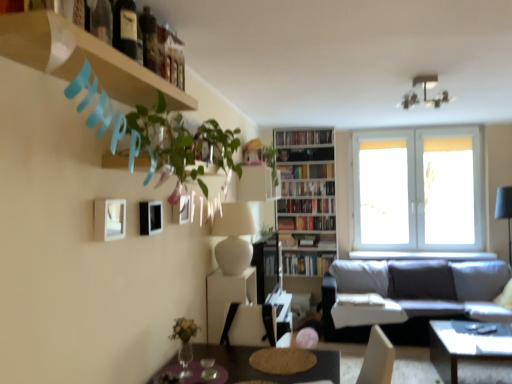
Question: From the image's perspective, is hardcover books at upper center, which is the first book in top-to-bottom order, beneath green leafy plant at upper left, the first plant viewed from the left?

Choices:
 (A) yes
 (B) no

Answer: (B)

Question: Can you confirm if hardcover books at upper center, which is the sixth book in bottom-to-top order, is taller than green leafy plant at upper left, which is the 1th plant in front-to-back order?

Choices:
 (A) no
 (B) yes

Answer: (A)

Question: Considering the relative positions of hardcover books at upper center, which is the first book in top-to-bottom order, and green leafy plant at upper left, which ranks as the 3th plant in back-to-front order, in the image provided, is hardcover books at upper center, which is the first book in top-to-bottom order, behind green leafy plant at upper left, which ranks as the 3th plant in back-to-front order,?

Choices:
 (A) no
 (B) yes

Answer: (B)

Question: Can you confirm if hardcover books at upper center, which is the first book in top-to-bottom order, is smaller than green leafy plant at upper left, which ranks as the 3th plant in back-to-front order?

Choices:
 (A) yes
 (B) no

Answer: (A)

Question: Does hardcover books at upper center, which is the sixth book in bottom-to-top order, have a lesser width compared to green leafy plant at upper left, which ranks as the 3th plant in back-to-front order?

Choices:
 (A) yes
 (B) no

Answer: (A)

Question: Looking at their shapes, would you say matte black picture frame at upper center, positioned as the third picture frame in left-to-right order, is wider or thinner than white matte picture frame at upper left, marked as the 3th picture frame in a back-to-front arrangement?

Choices:
 (A) wide
 (B) thin

Answer: (B)

Question: Does point (179, 221) appear closer or farther from the camera than point (97, 203)?

Choices:
 (A) closer
 (B) farther

Answer: (B)

Question: Considering the positions of matte black picture frame at upper center, positioned as the third picture frame in left-to-right order, and white matte picture frame at upper left, arranged as the 1th picture frame when viewed from the front, in the image, is matte black picture frame at upper center, positioned as the third picture frame in left-to-right order, bigger or smaller than white matte picture frame at upper left, arranged as the 1th picture frame when viewed from the front,?

Choices:
 (A) big
 (B) small

Answer: (B)

Question: Relative to white matte picture frame at upper left, arranged as the 1th picture frame when viewed from the front, is matte black picture frame at upper center, positioned as the first picture frame in right-to-left order, in front or behind?

Choices:
 (A) front
 (B) behind

Answer: (B)

Question: From a real-world perspective, relative to green glass wine bottle at upper left, acting as the third wine bottle starting from the back, is hardcover books at upper center, which is the first book in top-to-bottom order, vertically above or below?

Choices:
 (A) below
 (B) above

Answer: (B)

Question: Is hardcover books at upper center, which is the first book in top-to-bottom order, bigger or smaller than green glass wine bottle at upper left, acting as the third wine bottle starting from the back?

Choices:
 (A) big
 (B) small

Answer: (A)

Question: Relative to green glass wine bottle at upper left, acting as the third wine bottle starting from the back, is hardcover books at upper center, which is the sixth book in bottom-to-top order, in front or behind?

Choices:
 (A) behind
 (B) front

Answer: (A)

Question: From the image's perspective, is hardcover books at upper center, which is the sixth book in bottom-to-top order, above or below green glass wine bottle at upper left, acting as the third wine bottle starting from the back?

Choices:
 (A) above
 (B) below

Answer: (A)

Question: From the image's perspective, is wooden shelf at upper left above or below hardcover books at upper center, which is the first book in top-to-bottom order?

Choices:
 (A) above
 (B) below

Answer: (B)

Question: In terms of height, does wooden shelf at upper left look taller or shorter compared to hardcover books at upper center, which is the sixth book in bottom-to-top order?

Choices:
 (A) short
 (B) tall

Answer: (A)